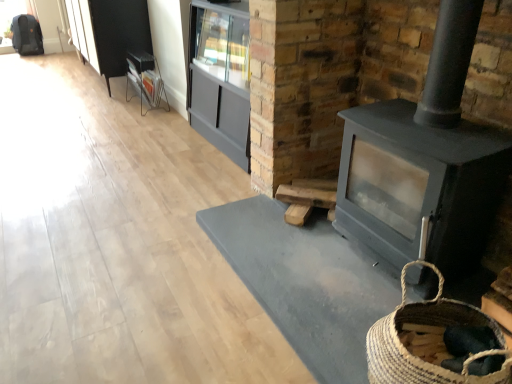
Question: From a real-world perspective, is metallic silver magazine rack at upper left above or below natural woven basket at lower right?

Choices:
 (A) above
 (B) below

Answer: (B)

Question: In terms of height, does metallic silver magazine rack at upper left look taller or shorter compared to natural woven basket at lower right?

Choices:
 (A) tall
 (B) short

Answer: (A)

Question: Considering the real-world distances, which object is farthest from the matte gray wood burning stove at right?

Choices:
 (A) natural woven basket at lower right
 (B) matte gray cabinet at center
 (C) metallic silver magazine rack at upper left

Answer: (C)

Question: Considering the real-world distances, which object is closest to the metallic silver magazine rack at upper left?

Choices:
 (A) matte gray wood burning stove at right
 (B) natural woven basket at lower right
 (C) matte gray cabinet at center

Answer: (C)